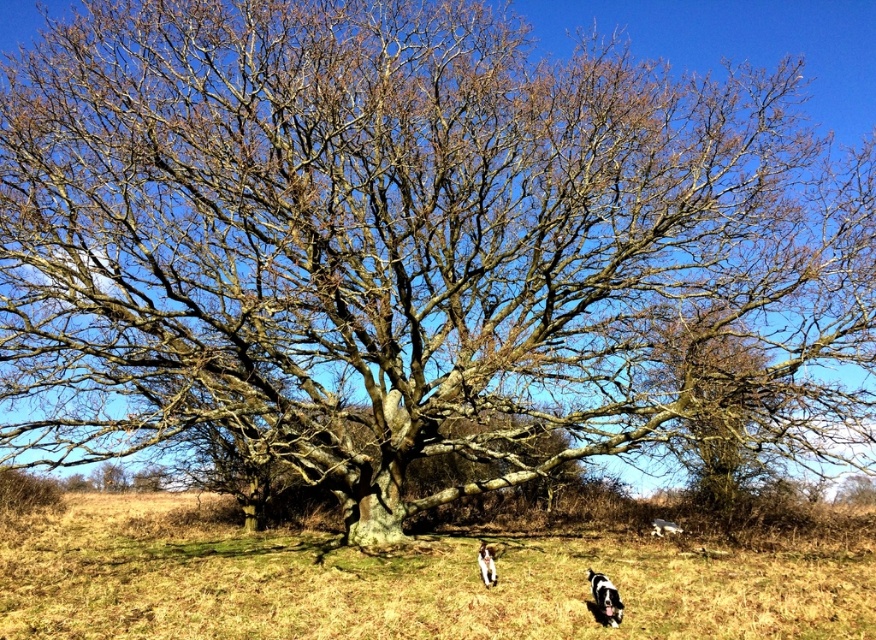
Does brown grass at center have a greater width compared to white fur dog at lower center?

Yes, brown grass at center is wider than white fur dog at lower center.

Does point (150, 589) come in front of point (479, 570)?

Yes, it is in front of point (479, 570).

Between point (670, 548) and point (478, 548), which one is positioned behind?

Point (670, 548)

Identify the location of brown grass at center. (401, 582).